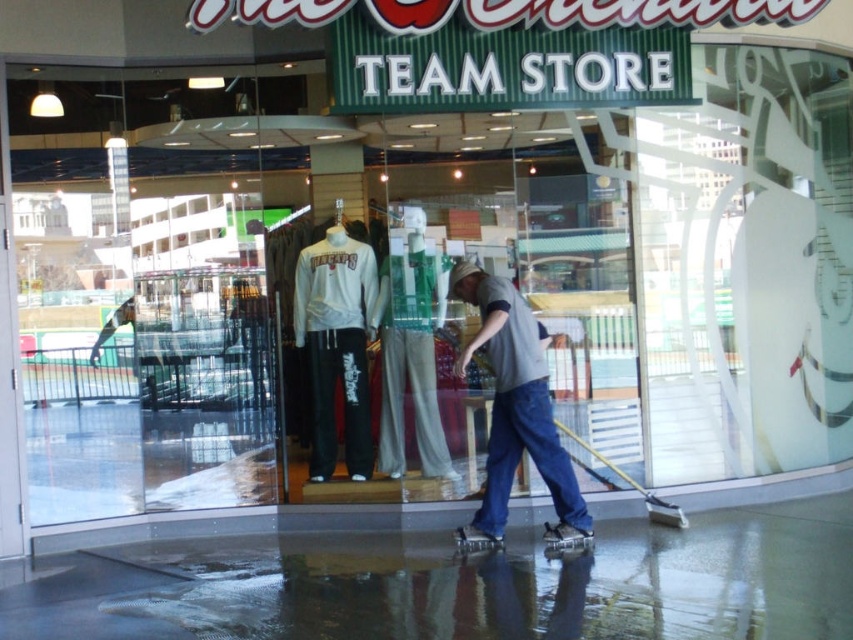
You are a customer entering the Team Store and need to grab the gray cotton shirt at center before the store closes in 2 minutes. Can you reach it quickly through the transparent glass door at left?

The transparent glass door at left is positioned over gray cotton shirt at center, so you can reach the gray cotton shirt at center quickly by passing through the transparent glass door at left since it is directly above it.

You are a customer entering the Team Store and want to check the height of the transparent glass door at left and the gray cotton shirt at center. Which one is taller?

The transparent glass door at left is taller than the gray cotton shirt at center.